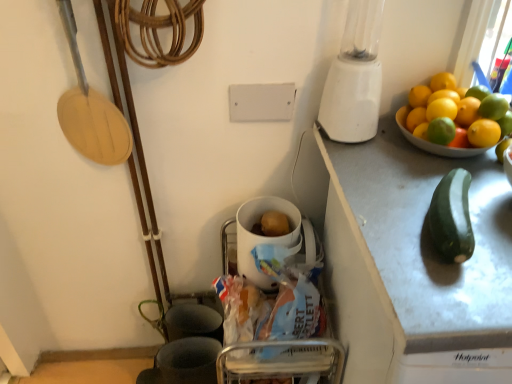
Where is `unoccupied area in front of yellow matte lemon at upper right, acting as the 4th lemon starting from the bottom`? Image resolution: width=512 pixels, height=384 pixels. unoccupied area in front of yellow matte lemon at upper right, acting as the 4th lemon starting from the bottom is located at coordinates (464, 185).